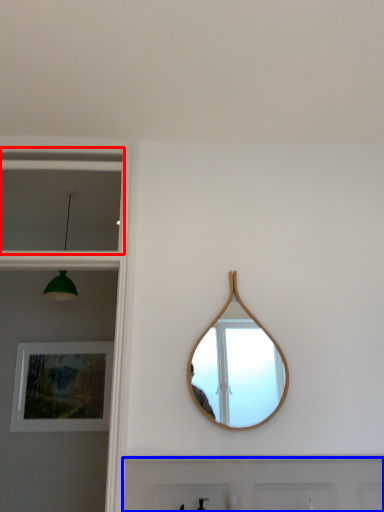
Question: Among these objects, which one is nearest to the camera, window (highlighted by a red box) or door (highlighted by a blue box)?

Choices:
 (A) window
 (B) door

Answer: (B)